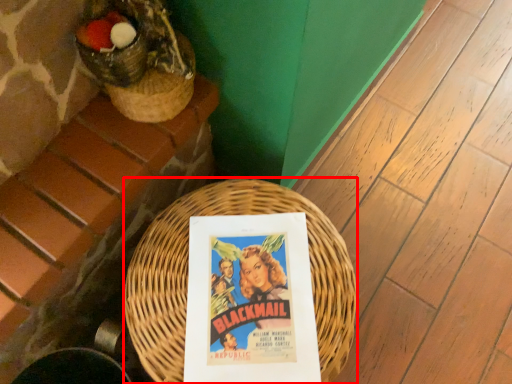
Question: Observing the image, what is the correct spatial positioning of basket (annotated by the red box) in reference to paperback book?

Choices:
 (A) right
 (B) left

Answer: (B)